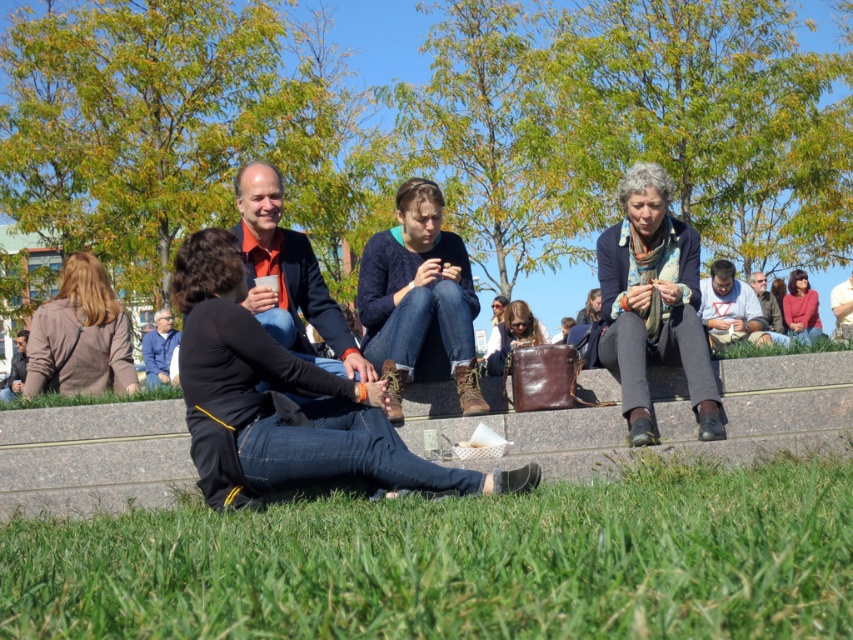
Is matte brown sweater at lower left shorter than dark gray leather jacket at lower left?

No.

Between matte brown sweater at lower left and dark gray leather jacket at lower left, which one appears on the right side from the viewer's perspective?

matte brown sweater at lower left

Between point (86, 337) and point (22, 381), which one is positioned in front?

Positioned in front is point (86, 337).

Where is `matte brown sweater at lower left`? matte brown sweater at lower left is located at coordinates (80, 336).

Is matte orange shirt at center taller than matte gray shirt at center?

Correct, matte orange shirt at center is much taller as matte gray shirt at center.

Is matte orange shirt at center shorter than matte gray shirt at center?

Incorrect, matte orange shirt at center's height does not fall short of matte gray shirt at center's.

Find the location of a particular element. matte orange shirt at center is located at coordinates (288, 268).

Does denim jeans at center have a greater height compared to matte pink sweater at right?

Yes.

Between point (404, 266) and point (802, 272), which one is positioned in front?

Point (404, 266)

Where is `denim jeans at center`? denim jeans at center is located at coordinates (419, 300).

Locate an element on the screen. The height and width of the screenshot is (640, 853). denim jeans at center is located at coordinates (419, 300).